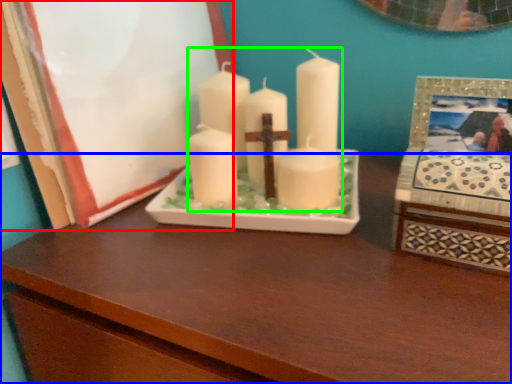
Question: Which object is the closest to the picture frame (highlighted by a red box)? Choose among these: table (highlighted by a blue box) or candle (highlighted by a green box).

Choices:
 (A) table
 (B) candle

Answer: (B)